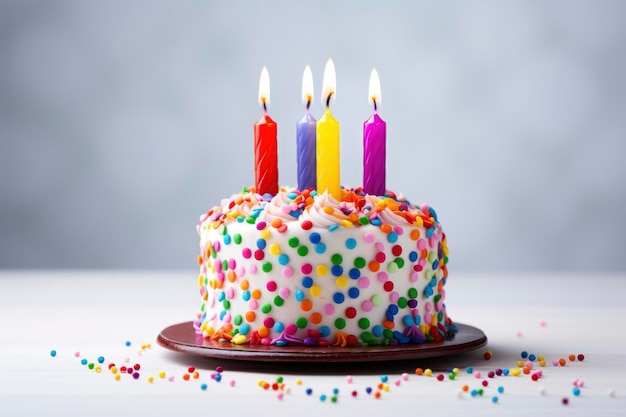
Find the location of a particular element. The width and height of the screenshot is (626, 417). birthday candle is located at coordinates (267, 143), (309, 144), (322, 144), (371, 145).